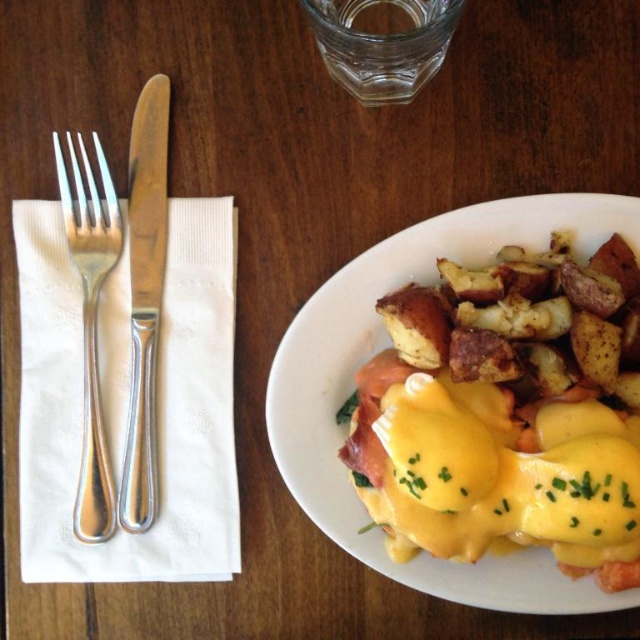
Question: Which object appears closest to the camera in this image?

Choices:
 (A) satin silver fork at left
 (B) yellow creamy hollandaise sauce at center

Answer: (B)

Question: In this image, where is yellow creamy hollandaise sauce at center located relative to polished metal knife at left?

Choices:
 (A) right
 (B) left

Answer: (A)

Question: Which point appears farthest from the camera in this image?

Choices:
 (A) (150, 236)
 (B) (620, 246)
 (C) (77, 516)

Answer: (A)

Question: Can you confirm if yellow creamy hollandaise sauce at center is wider than satin silver fork at left?

Choices:
 (A) yes
 (B) no

Answer: (A)

Question: Is yellow creamy hollandaise sauce at center to the right of polished metal knife at left from the viewer's perspective?

Choices:
 (A) no
 (B) yes

Answer: (B)

Question: Which point is farther to the camera?

Choices:
 (A) (92, 506)
 (B) (148, 390)

Answer: (B)